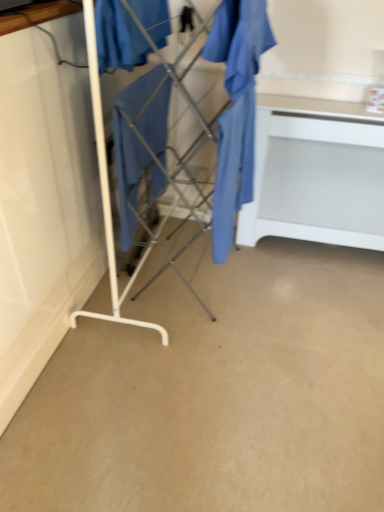
At what (x,y) coordinates should I click in order to perform the action: click on white matte table at center. Please return your answer as a coordinate pair (x, y). The width and height of the screenshot is (384, 512). Looking at the image, I should click on (316, 174).

At what (x,y) coordinates should I click in order to perform the action: click on matte blue fabric at center, the 1th clothing when ordered from left to right. Please return your answer as a coordinate pair (x, y). This screenshot has width=384, height=512. Looking at the image, I should click on (118, 37).

This screenshot has width=384, height=512. In order to click on metal drying rack at center in this screenshot , I will do `click(107, 193)`.

Measure the distance between matte blue fabric at center, arranged as the 3th clothing when viewed from the left, and camera.

The depth of matte blue fabric at center, arranged as the 3th clothing when viewed from the left, is 1.40 meters.

This screenshot has height=512, width=384. Identify the location of beige carpet at center. [x=216, y=394].

Measure the distance between white matte table at center and metal drying rack at center.

white matte table at center is 37.05 inches away from metal drying rack at center.

Is white matte table at center facing away from metal drying rack at center?

No, white matte table at center is not facing away from metal drying rack at center.

From the image's perspective, does white matte table at center appear lower than metal drying rack at center?

Indeed, from the image's perspective, white matte table at center is shown beneath metal drying rack at center.

From a real-world perspective, is white matte table at center physically located above or below metal drying rack at center?

white matte table at center is below metal drying rack at center.

Looking at this image, from a real-world perspective, does matte blue fabric at center, which is counted as the 2th clothing, starting from the left, sit lower than matte blue fabric at center, arranged as the 3th clothing when viewed from the left?

Yes, from a real-world perspective, matte blue fabric at center, which is counted as the 2th clothing, starting from the left, is below matte blue fabric at center, arranged as the 3th clothing when viewed from the left.

Is matte blue fabric at center, which is counted as the 2th clothing, starting from the left, not close to matte blue fabric at center, the first clothing from the right?

No, matte blue fabric at center, which is counted as the 2th clothing, starting from the left, is not far away from matte blue fabric at center, the first clothing from the right.

Does matte blue fabric at center, which is the 2th clothing in right-to-left order, have a lesser width compared to matte blue fabric at center, the first clothing from the right?

Correct, the width of matte blue fabric at center, which is the 2th clothing in right-to-left order, is less than that of matte blue fabric at center, the first clothing from the right.

In the image, is matte blue fabric at center, which is the 2th clothing in right-to-left order, positioned in front of or behind matte blue fabric at center, arranged as the 3th clothing when viewed from the left?

Visually, matte blue fabric at center, which is the 2th clothing in right-to-left order, is located behind matte blue fabric at center, arranged as the 3th clothing when viewed from the left.

Looking at this image, is matte blue fabric at center, arranged as the 3th clothing when viewed from the left, to the left of beige carpet at center from the viewer's perspective?

Incorrect, matte blue fabric at center, arranged as the 3th clothing when viewed from the left, is not on the left side of beige carpet at center.

Is matte blue fabric at center, the first clothing from the right, closer to the viewer compared to beige carpet at center?

No, matte blue fabric at center, the first clothing from the right, is further to the viewer.

From the image's perspective, is matte blue fabric at center, arranged as the 3th clothing when viewed from the left, above or below beige carpet at center?

Based on their image positions, matte blue fabric at center, arranged as the 3th clothing when viewed from the left, is located above beige carpet at center.

Looking at this image, is matte blue fabric at center, which is counted as the 2th clothing, starting from the left, aimed at metal drying rack at center?

Yes, matte blue fabric at center, which is counted as the 2th clothing, starting from the left, is turned towards metal drying rack at center.

Does point (146, 112) come closer to viewer compared to point (84, 1)?

No, (146, 112) is further to viewer.

Is matte blue fabric at center, which is the 2th clothing in right-to-left order, behind metal drying rack at center?

Yes, it is behind metal drying rack at center.

Is white matte table at center facing away from beige carpet at center?

white matte table at center does not have its back to beige carpet at center.

Is white matte table at center smaller than beige carpet at center?

Actually, white matte table at center might be larger than beige carpet at center.

Is white matte table at center thinner than beige carpet at center?

Yes, white matte table at center is thinner than beige carpet at center.

Which point is more distant from viewer, (104, 67) or (241, 151)?

Point (241, 151)

Between matte blue fabric at center, arranged as the 3th clothing when viewed from the right, and matte blue fabric at center, arranged as the 3th clothing when viewed from the left, which one is positioned in front?

matte blue fabric at center, arranged as the 3th clothing when viewed from the right.

Is matte blue fabric at center, arranged as the 3th clothing when viewed from the right, with matte blue fabric at center, the first clothing from the right?

No, matte blue fabric at center, arranged as the 3th clothing when viewed from the right, is not next to matte blue fabric at center, the first clothing from the right.

Is white matte table at center bigger or smaller than matte blue fabric at center, which is counted as the 2th clothing, starting from the left?

Clearly, white matte table at center is larger in size than matte blue fabric at center, which is counted as the 2th clothing, starting from the left.

Is white matte table at center shorter than matte blue fabric at center, which is counted as the 2th clothing, starting from the left?

No, white matte table at center is not shorter than matte blue fabric at center, which is counted as the 2th clothing, starting from the left.

Are white matte table at center and matte blue fabric at center, which is counted as the 2th clothing, starting from the left, located far from each other?

No, white matte table at center is not far away from matte blue fabric at center, which is counted as the 2th clothing, starting from the left.

Which object is wider, white matte table at center or matte blue fabric at center, which is the 2th clothing in right-to-left order?

white matte table at center is wider.

Find the location of a particular element. The width and height of the screenshot is (384, 512). furniture to the left of white matte table at center is located at coordinates (107, 193).

Locate an element on the screen. clothing that appears below the matte blue fabric at center, arranged as the 3th clothing when viewed from the left (from a real-world perspective) is located at coordinates (131, 149).

From the picture: Estimate the real-world distances between objects in this image. Which object is closer to matte blue fabric at center, the 1th clothing when ordered from left to right, matte blue fabric at center, arranged as the 3th clothing when viewed from the left, or beige carpet at center?

Based on the image, matte blue fabric at center, arranged as the 3th clothing when viewed from the left, appears to be nearer to matte blue fabric at center, the 1th clothing when ordered from left to right.

Which object lies nearer to the anchor point metal drying rack at center, beige carpet at center or white matte table at center?

beige carpet at center is closer to metal drying rack at center.

From the image, which object appears to be nearer to matte blue fabric at center, the first clothing from the right, matte blue fabric at center, the 1th clothing when ordered from left to right, or metal drying rack at center?

matte blue fabric at center, the 1th clothing when ordered from left to right, lies closer to matte blue fabric at center, the first clothing from the right, than the other object.

Which object lies nearer to the anchor point beige carpet at center, matte blue fabric at center, which is the 2th clothing in right-to-left order, or matte blue fabric at center, arranged as the 3th clothing when viewed from the right?

matte blue fabric at center, which is the 2th clothing in right-to-left order.

Considering their positions, is beige carpet at center positioned further to matte blue fabric at center, the 1th clothing when ordered from left to right, than white matte table at center?

beige carpet at center is positioned further to the anchor matte blue fabric at center, the 1th clothing when ordered from left to right.

Consider the image. Looking at the image, which one is located closer to matte blue fabric at center, the first clothing from the right, beige carpet at center or matte blue fabric at center, the 1th clothing when ordered from left to right?

matte blue fabric at center, the 1th clothing when ordered from left to right, is positioned closer to the anchor matte blue fabric at center, the first clothing from the right.

Looking at this image, looking at the image, which one is located further to matte blue fabric at center, arranged as the 3th clothing when viewed from the right, metal drying rack at center or matte blue fabric at center, which is counted as the 2th clothing, starting from the left?

Among the two, metal drying rack at center is located further to matte blue fabric at center, arranged as the 3th clothing when viewed from the right.

When comparing their distances from matte blue fabric at center, the first clothing from the right, does matte blue fabric at center, the 1th clothing when ordered from left to right, or matte blue fabric at center, which is counted as the 2th clothing, starting from the left, seem closer?

matte blue fabric at center, the 1th clothing when ordered from left to right, lies closer to matte blue fabric at center, the first clothing from the right, than the other object.

Find the location of a particular element. clothing between matte blue fabric at center, arranged as the 3th clothing when viewed from the right, and metal drying rack at center in the up-down direction is located at coordinates 131,149.

Identify the location of furniture between matte blue fabric at center, which is the 2th clothing in right-to-left order, and white matte table at center, in the horizontal direction. (107, 193).

Find the location of a particular element. The width and height of the screenshot is (384, 512). furniture between matte blue fabric at center, arranged as the 3th clothing when viewed from the right, and white matte table at center, in the horizontal direction is located at coordinates 107,193.

At what (x,y) coordinates should I click in order to perform the action: click on clothing between metal drying rack at center and beige carpet at center in the up-down direction. Please return your answer as a coordinate pair (x, y). Looking at the image, I should click on (236, 109).